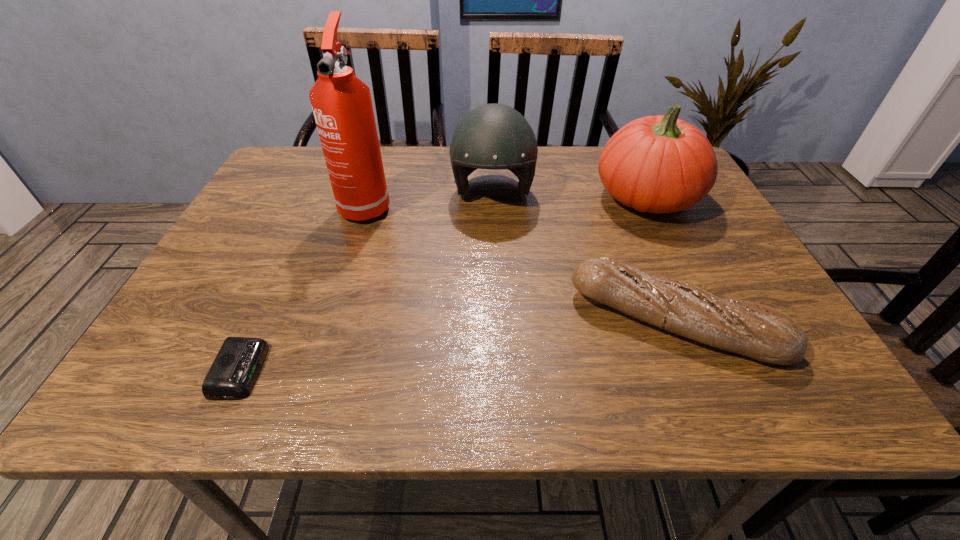
What are the coordinates of `blank space located on the back of the baguet` in the screenshot? It's located at (625, 200).

Where is `vacant area situated 0.340m on the display of the leftmost object`? The width and height of the screenshot is (960, 540). vacant area situated 0.340m on the display of the leftmost object is located at coordinates (459, 370).

The height and width of the screenshot is (540, 960). I want to click on fire extinguisher that is at the far edge, so tap(342, 106).

The image size is (960, 540). Identify the location of pumpkin located in the far edge section of the desktop. (658, 164).

What are the coordinates of `football helmet located in the far edge section of the desktop` in the screenshot? It's located at (493, 136).

Where is `baguet present at the near edge`? The image size is (960, 540). baguet present at the near edge is located at coordinates (760, 332).

Find the location of a particular element. This screenshot has width=960, height=540. alarm clock that is at the near edge is located at coordinates (234, 371).

Identify the location of object situated at the left edge. This screenshot has width=960, height=540. (234, 371).

What are the coordinates of `pumpkin positioned at the right edge` in the screenshot? It's located at (658, 164).

Find the location of a particular element. baguet present at the right edge is located at coordinates (760, 332).